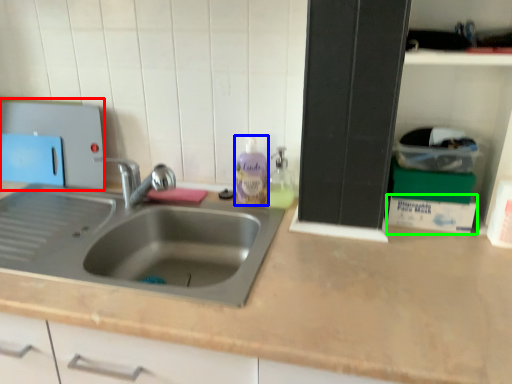
Question: Considering the real-world distances, which object is farthest from appliance (highlighted by a red box)? cleaning product (highlighted by a blue box) or box (highlighted by a green box)?

Choices:
 (A) cleaning product
 (B) box

Answer: (B)